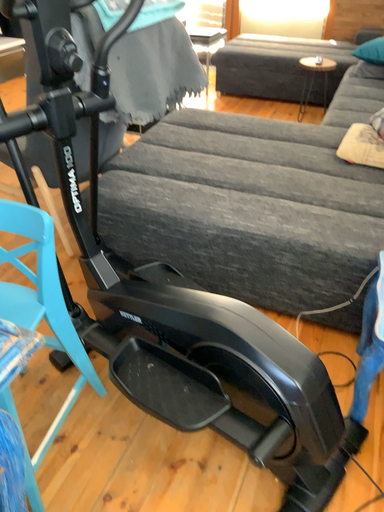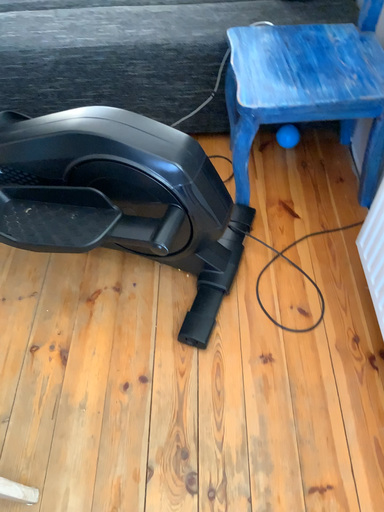
Question: How did the camera likely rotate when shooting the video?

Choices:
 (A) rotated upward
 (B) rotated downward

Answer: (B)